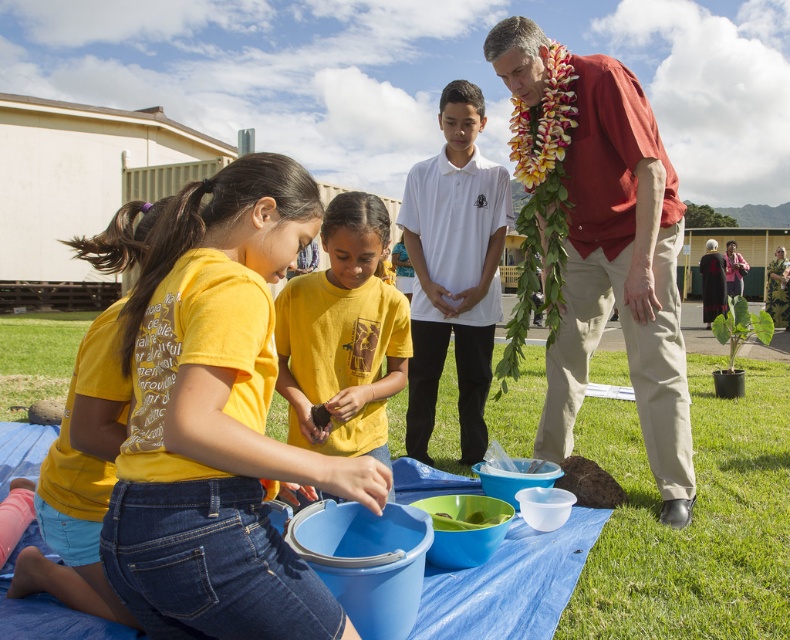
Which of these two, yellow matte shirt at center or green leafy plant at lower right, stands taller?

Standing taller between the two is yellow matte shirt at center.

Who is more forward, (362, 284) or (734, 298)?

Point (362, 284) is more forward.

Identify the location of yellow matte shirt at center. (343, 336).

Between yellow matte shirt at center and green leafy plant at lower left, which one is positioned lower?

green leafy plant at lower left is lower down.

Is yellow matte shirt at center in front of green leafy plant at lower left?

That is True.

The image size is (790, 640). I want to click on yellow matte shirt at center, so click(343, 336).

The height and width of the screenshot is (640, 790). What are the coordinates of `yellow matte shirt at center` in the screenshot? It's located at (343, 336).

Is yellow cotton shirt at center smaller than yellow cotton shirt at lower left?

Indeed, yellow cotton shirt at center has a smaller size compared to yellow cotton shirt at lower left.

Is yellow cotton shirt at center thinner than yellow cotton shirt at lower left?

Indeed, yellow cotton shirt at center has a lesser width compared to yellow cotton shirt at lower left.

The image size is (790, 640). Identify the location of yellow cotton shirt at center. (217, 420).

Where is `yellow cotton shirt at center`? yellow cotton shirt at center is located at coordinates (217, 420).